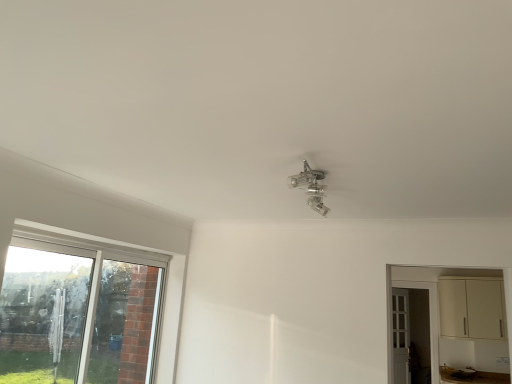
What is the approximate height of clear glass window at lower left?

clear glass window at lower left is 3.73 feet tall.

In order to face clear glass screen door at center, should I rotate leftwards or rightwards?

It's best to rotate right around 20.123 degrees.

What do you see at coordinates (400, 336) in the screenshot? I see `white wooden door at right` at bounding box center [400, 336].

Identify the location of clear plastic umbrella at left. [42, 315].

What is the approximate width of clear plastic umbrella at left?

clear plastic umbrella at left is 6.02 centimeters wide.

This screenshot has height=384, width=512. Describe the element at coordinates (429, 308) in the screenshot. I see `cream matte cabinet at right` at that location.

Measure the distance between point (435,298) and camera.

The distance of point (435,298) from camera is 19.44 feet.

The image size is (512, 384). Find the location of `metallic glass light fixture at center`. metallic glass light fixture at center is located at coordinates (311, 187).

From a real-world perspective, which is physically above, cream matte cabinet at right or clear glass window at lower left?

From a 3D spatial view, cream matte cabinet at right is above.

How distant is cream matte cabinet at right from clear glass window at lower left?

The distance of cream matte cabinet at right from clear glass window at lower left is 4.54 meters.

Which object is positioned more to the right, cream matte cabinet at right or clear glass window at lower left?

Positioned to the right is cream matte cabinet at right.

Would you say clear glass window at lower left is part of cream matte cabinet at right's contents?

No, clear glass window at lower left is not a part of cream matte cabinet at right.

Which of these two, clear glass window at lower left or white wooden door at right, stands taller?

With more height is white wooden door at right.

Which object is positioned more to the right, clear glass window at lower left or white wooden door at right?

white wooden door at right is more to the right.

Is point (76, 370) closer or farther from the camera than point (397, 355)?

Point (76, 370) appears to be closer to the viewer than point (397, 355).

How far apart are clear glass window at lower left and white wooden door at right?

clear glass window at lower left and white wooden door at right are 4.44 meters apart.

Is clear glass window at lower left not close to clear plastic umbrella at left?

clear glass window at lower left is actually quite close to clear plastic umbrella at left.

Considering the sizes of clear glass window at lower left and clear plastic umbrella at left in the image, is clear glass window at lower left wider or thinner than clear plastic umbrella at left?

In the image, clear glass window at lower left appears to be more narrow than clear plastic umbrella at left.

Is clear plastic umbrella at left surrounded by clear glass window at lower left?

That's incorrect, clear plastic umbrella at left is not inside clear glass window at lower left.

Looking at the image, does clear glass window at lower left seem bigger or smaller compared to clear plastic umbrella at left?

Considering their sizes, clear glass window at lower left takes up more space than clear plastic umbrella at left.

Is clear glass screen door at center turned away from clear plastic umbrella at left?

No, clear plastic umbrella at left is not at the back of clear glass screen door at center.

Considering the sizes of objects clear glass screen door at center and clear plastic umbrella at left in the image provided, who is shorter, clear glass screen door at center or clear plastic umbrella at left?

clear plastic umbrella at left.

Between clear glass screen door at center and clear plastic umbrella at left, which one appears on the left side from the viewer's perspective?

Positioned to the left is clear plastic umbrella at left.

Is clear glass screen door at center further to the viewer compared to clear plastic umbrella at left?

Yes, clear glass screen door at center is further from the camera.

Who is bigger, cream matte cabinet at right or white wooden door at right?

cream matte cabinet at right is bigger.

In terms of height, does cream matte cabinet at right look taller or shorter compared to white wooden door at right?

Clearly, cream matte cabinet at right is shorter compared to white wooden door at right.

Is cream matte cabinet at right turned away from white wooden door at right?

That's right, cream matte cabinet at right is facing away from white wooden door at right.

From the picture: Can you see cream matte cabinet at right touching white wooden door at right?

No, cream matte cabinet at right is not beside white wooden door at right.

Considering the sizes of objects clear plastic umbrella at left and metallic glass light fixture at center in the image provided, who is smaller, clear plastic umbrella at left or metallic glass light fixture at center?

Smaller between the two is metallic glass light fixture at center.

Can you tell me how much clear plastic umbrella at left and metallic glass light fixture at center differ in facing direction?

There is a 7.04-degree angle between the facing directions of clear plastic umbrella at left and metallic glass light fixture at center.

From a real-world perspective, between clear plastic umbrella at left and metallic glass light fixture at center, who is vertically higher?

metallic glass light fixture at center.

From the image's perspective, is clear plastic umbrella at left over metallic glass light fixture at center?

No, from the image's perspective, clear plastic umbrella at left is not on top of metallic glass light fixture at center.

Is clear glass screen door at center wider than metallic glass light fixture at center?

No.

From a real-world perspective, is clear glass screen door at center beneath metallic glass light fixture at center?

Yes, from a real-world perspective, clear glass screen door at center is beneath metallic glass light fixture at center.

Considering the relative positions of clear glass screen door at center and metallic glass light fixture at center in the image provided, is clear glass screen door at center to the left of metallic glass light fixture at center from the viewer's perspective?

No.

Find the location of a particular element. Image resolution: width=512 pixels, height=384 pixels. light fixture above the clear glass screen door at center (from the image's perspective) is located at coordinates [x=311, y=187].

Locate an element on the screen. This screenshot has width=512, height=384. dresser below the clear glass window at lower left (from the image's perspective) is located at coordinates (429, 308).

Locate an element on the screen. door that is under the clear glass window at lower left (from a real-world perspective) is located at coordinates (400, 336).

Estimate the real-world distances between objects in this image. Which object is closer to clear glass window at lower left, white wooden door at right or metallic glass light fixture at center?

metallic glass light fixture at center lies closer to clear glass window at lower left than the other object.

When comparing their distances from clear glass window at lower left, does metallic glass light fixture at center or clear plastic umbrella at left seem closer?

Among the two, clear plastic umbrella at left is located nearer to clear glass window at lower left.

Based on their spatial positions, is white wooden door at right or clear plastic umbrella at left closer to metallic glass light fixture at center?

Among the two, clear plastic umbrella at left is located nearer to metallic glass light fixture at center.

Which object lies nearer to the anchor point white wooden door at right, clear glass screen door at center or cream matte cabinet at right?

Based on the image, clear glass screen door at center appears to be nearer to white wooden door at right.

Based on their spatial positions, is clear plastic umbrella at left or clear glass window at lower left further from metallic glass light fixture at center?

Among the two, clear plastic umbrella at left is located further to metallic glass light fixture at center.

From the image, which object appears to be nearer to cream matte cabinet at right, white wooden door at right or clear glass window at lower left?

The object closer to cream matte cabinet at right is white wooden door at right.

When comparing their distances from white wooden door at right, does clear plastic umbrella at left or clear glass window at lower left seem closer?

clear glass window at lower left.

From the image, which object appears to be nearer to clear plastic umbrella at left, metallic glass light fixture at center or clear glass window at lower left?

clear glass window at lower left lies closer to clear plastic umbrella at left than the other object.

The height and width of the screenshot is (384, 512). I want to click on dresser situated between clear plastic umbrella at left and clear glass screen door at center from left to right, so click(x=429, y=308).

Where is `window located between clear plastic umbrella at left and metallic glass light fixture at center in the left-right direction`? This screenshot has width=512, height=384. window located between clear plastic umbrella at left and metallic glass light fixture at center in the left-right direction is located at coordinates point(79,311).

Identify the location of window positioned between metallic glass light fixture at center and white wooden door at right from near to far. This screenshot has height=384, width=512. (79, 311).

The width and height of the screenshot is (512, 384). What are the coordinates of `window located between metallic glass light fixture at center and clear glass screen door at center in the depth direction` in the screenshot? It's located at (79, 311).